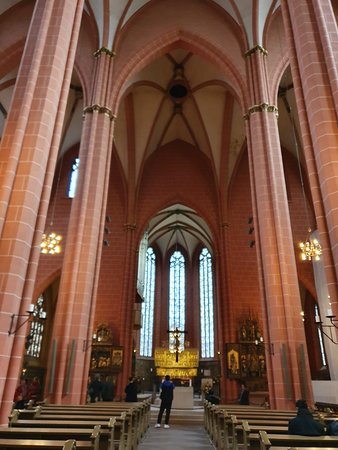
Locate an element on the screen. The height and width of the screenshot is (450, 338). brown crucifix is located at coordinates (177, 340).